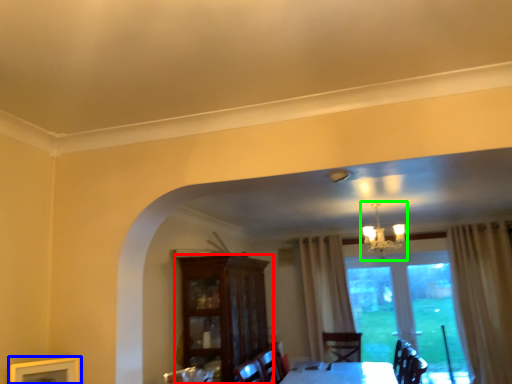
Question: Considering the real-world distances, which object is farthest from cabinetry (highlighted by a red box)? picture frame (highlighted by a blue box) or light fixture (highlighted by a green box)?

Choices:
 (A) picture frame
 (B) light fixture

Answer: (B)